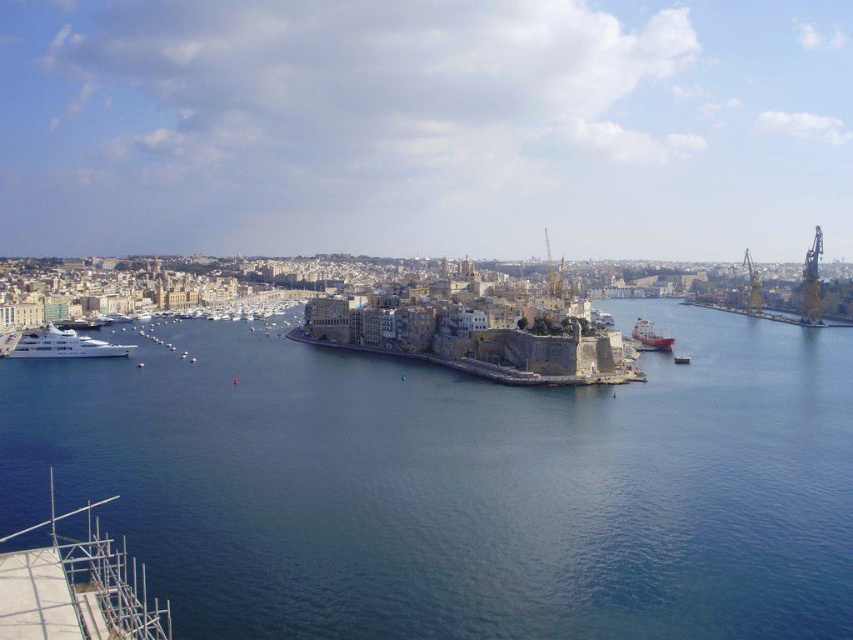
Is yellow metallic crane at right below red matte ship at center?

Actually, yellow metallic crane at right is above red matte ship at center.

Does yellow metallic crane at right appear over red matte ship at center?

Correct, yellow metallic crane at right is located above red matte ship at center.

Is point (815, 230) behind point (637, 320)?

No, (815, 230) is closer to viewer.

At what (x,y) coordinates should I click in order to perform the action: click on yellow metallic crane at right. Please return your answer as a coordinate pair (x, y). The image size is (853, 640). Looking at the image, I should click on (811, 282).

Who is lower down, white glossy yacht at lower left or metallic gray boat at center?

metallic gray boat at center is below.

Is white glossy yacht at lower left smaller than metallic gray boat at center?

Incorrect, white glossy yacht at lower left is not smaller in size than metallic gray boat at center.

Measure the distance between white glossy yacht at lower left and camera.

A distance of 157.38 meters exists between white glossy yacht at lower left and camera.

Where is `white glossy yacht at lower left`? white glossy yacht at lower left is located at coordinates (64, 346).

Between point (660, 333) and point (675, 356), which one is positioned behind?

The point (660, 333) is more distant.

Does red matte ship at center have a greater width compared to metallic gray boat at center?

Indeed, red matte ship at center has a greater width compared to metallic gray boat at center.

What do you see at coordinates (650, 337) in the screenshot? The image size is (853, 640). I see `red matte ship at center` at bounding box center [650, 337].

Find the location of a particular element. This screenshot has width=853, height=640. red matte ship at center is located at coordinates (650, 337).